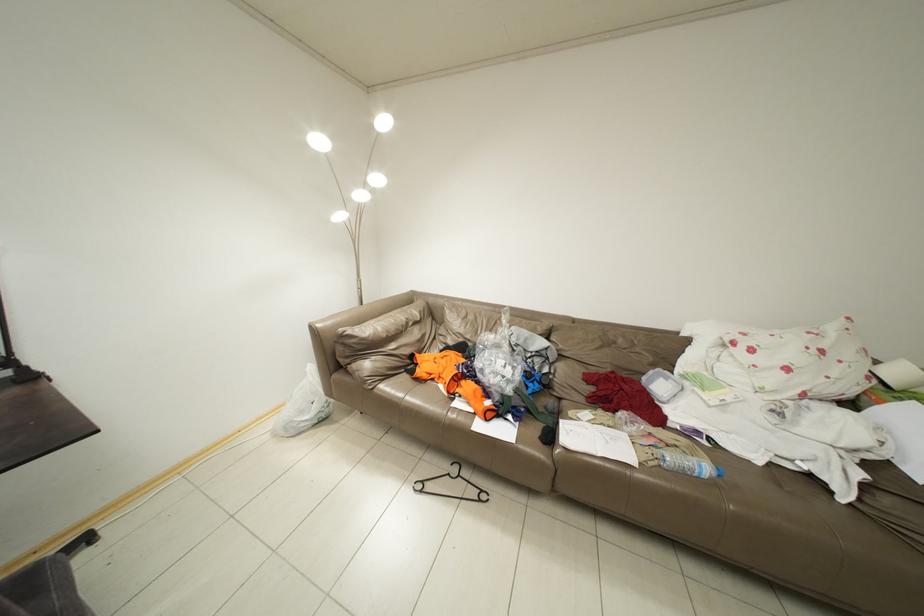
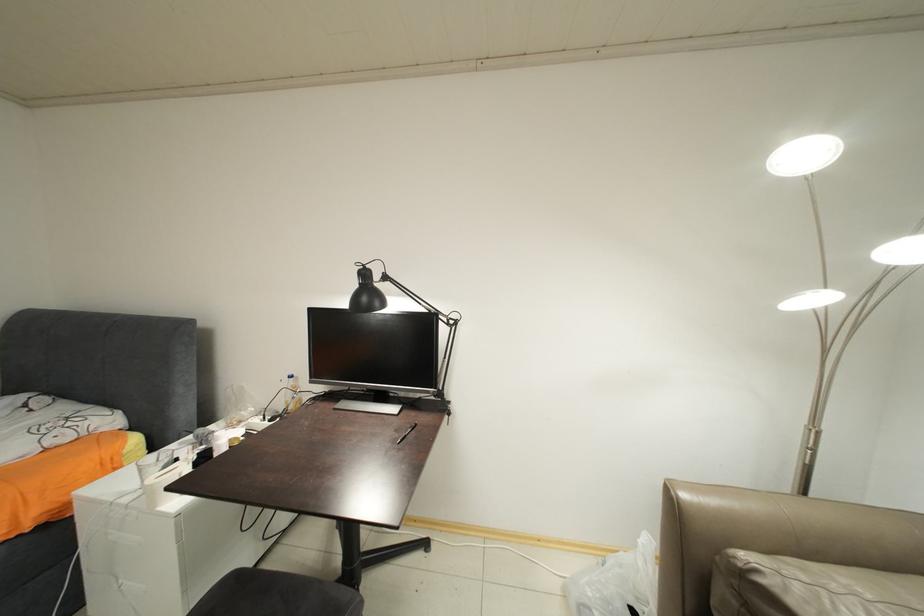
Question: The first image is from the beginning of the video and the second image is from the end. How did the camera likely rotate when shooting the video?

Choices:
 (A) Left
 (B) Right
 (C) Up
 (D) Down

Answer: (A)